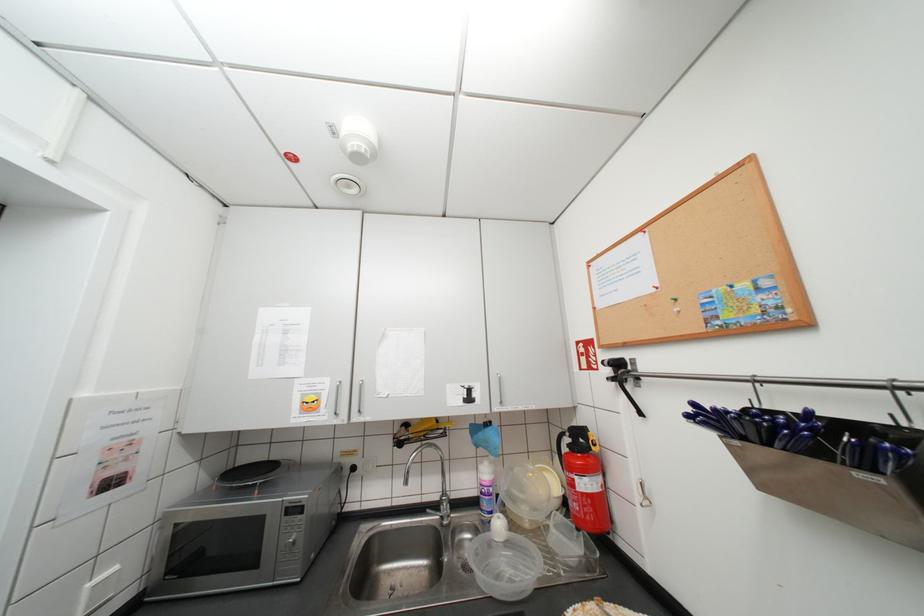
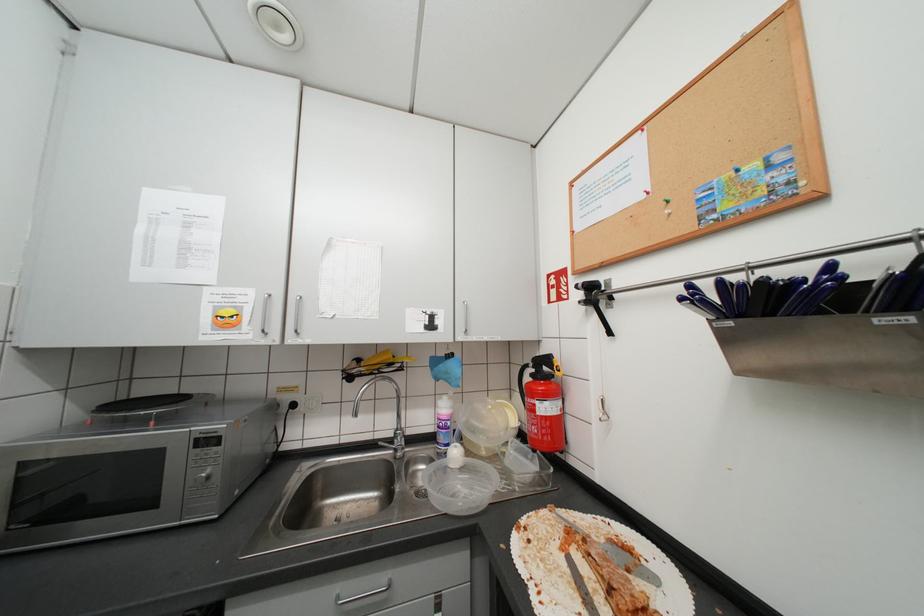
Question: In a continuous first-person perspective shot, in which direction is the camera moving?

Choices:
 (A) Left
 (B) Right
 (C) Forward
 (D) Backward

Answer: (C)